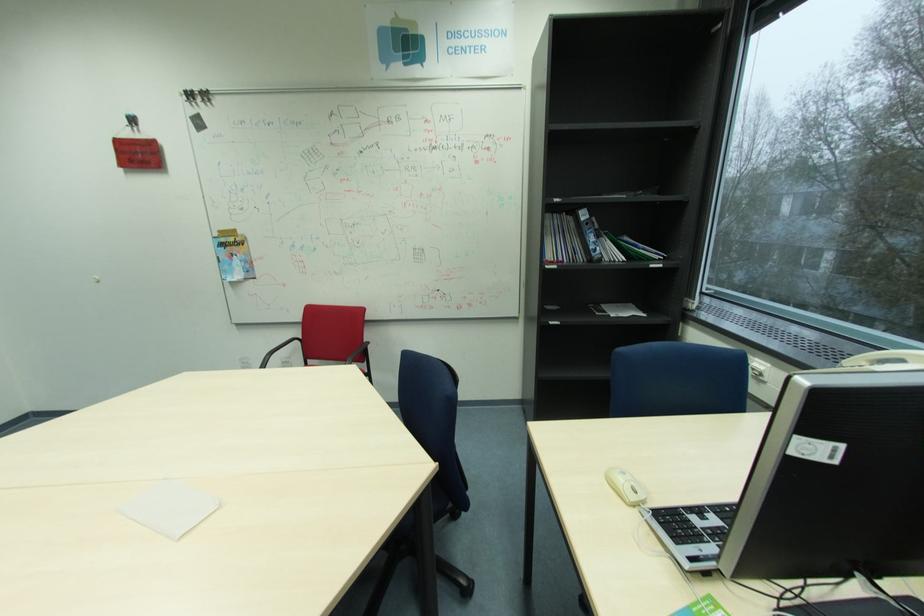
Find where to wip the white paper napkin. Please return your answer as a coordinate pair (x, y).

(169, 508)